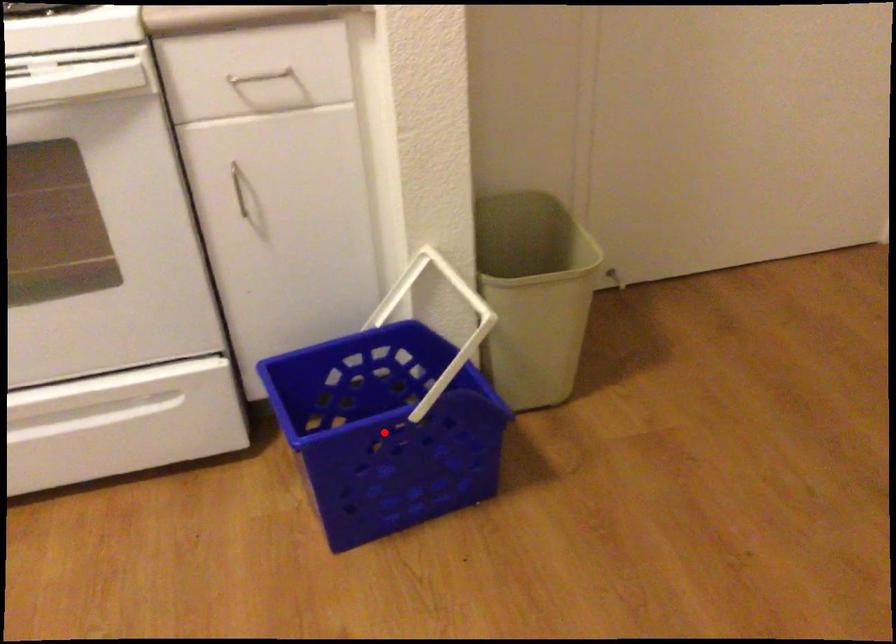
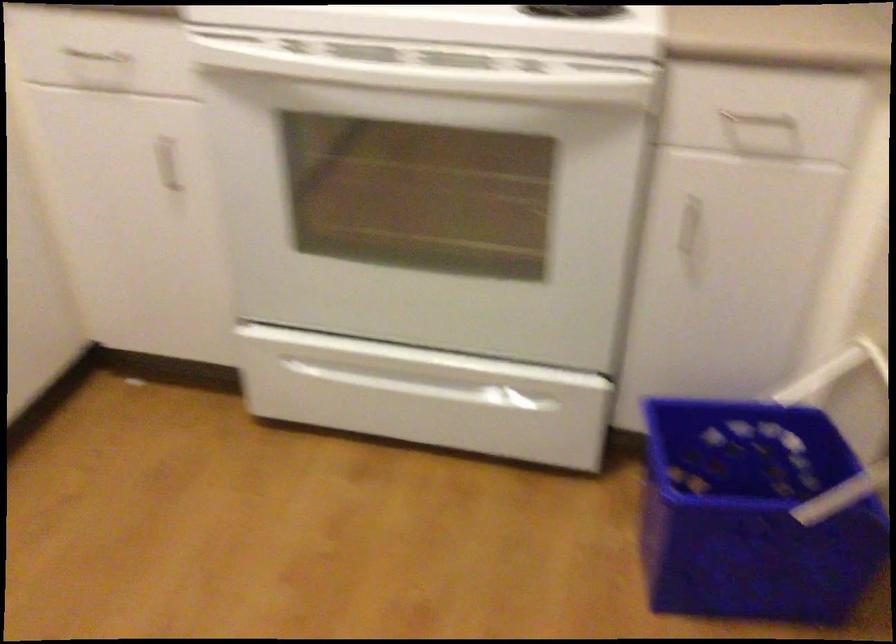
Question: I am providing you with two images of the same scene from different viewpoints. A red point is marked on the first image. At the location where the point appears in image 1, is it still visible in image 2?

Choices:
 (A) Yes
 (B) No

Answer: (A)